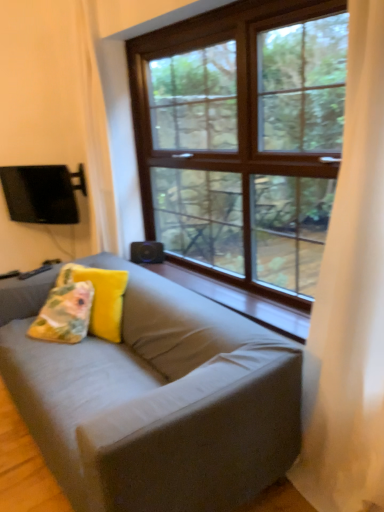
Question: Is white sheer curtain at right to the left of yellow fabric pillow at center, the first pillow when ordered from right to left, from the viewer's perspective?

Choices:
 (A) no
 (B) yes

Answer: (A)

Question: From the image's perspective, is white sheer curtain at right on yellow fabric pillow at center, positioned as the second pillow in left-to-right order?

Choices:
 (A) yes
 (B) no

Answer: (A)

Question: Can you see white sheer curtain at right touching yellow fabric pillow at center, the first pillow when ordered from right to left?

Choices:
 (A) yes
 (B) no

Answer: (B)

Question: Is white sheer curtain at right shorter than yellow fabric pillow at center, positioned as the second pillow in left-to-right order?

Choices:
 (A) no
 (B) yes

Answer: (A)

Question: From a real-world perspective, is white sheer curtain at right positioned under yellow fabric pillow at center, positioned as the second pillow in left-to-right order, based on gravity?

Choices:
 (A) no
 (B) yes

Answer: (A)

Question: Is white sheer curtain at right far from yellow fabric pillow at center, the first pillow when ordered from right to left?

Choices:
 (A) yes
 (B) no

Answer: (A)

Question: Does black matte speaker at center have a smaller size compared to matte gray couch at center?

Choices:
 (A) no
 (B) yes

Answer: (B)

Question: Considering the relative positions of black matte speaker at center and matte gray couch at center in the image provided, is black matte speaker at center behind matte gray couch at center?

Choices:
 (A) yes
 (B) no

Answer: (A)

Question: Could you tell me if black matte speaker at center is turned towards matte gray couch at center?

Choices:
 (A) yes
 (B) no

Answer: (A)

Question: Does black matte speaker at center appear on the right side of matte gray couch at center?

Choices:
 (A) no
 (B) yes

Answer: (B)

Question: From the image's perspective, is black matte speaker at center on matte gray couch at center?

Choices:
 (A) no
 (B) yes

Answer: (B)

Question: Can you confirm if black matte speaker at center is thinner than matte gray couch at center?

Choices:
 (A) no
 (B) yes

Answer: (B)

Question: Is wooden at center completely or partially outside of white sheer curtain at right?

Choices:
 (A) yes
 (B) no

Answer: (A)